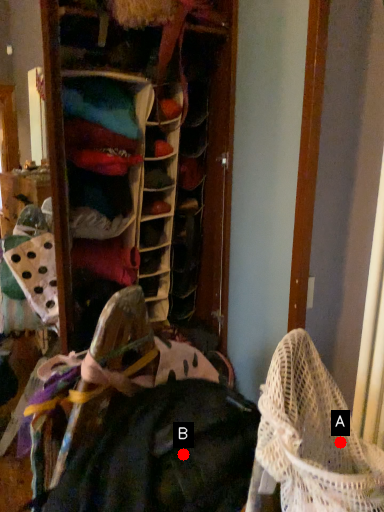
Question: Two points are circled on the image, labeled by A and B beside each circle. Which point is farther from the camera taking this photo?

Choices:
 (A) A is further
 (B) B is further

Answer: (B)